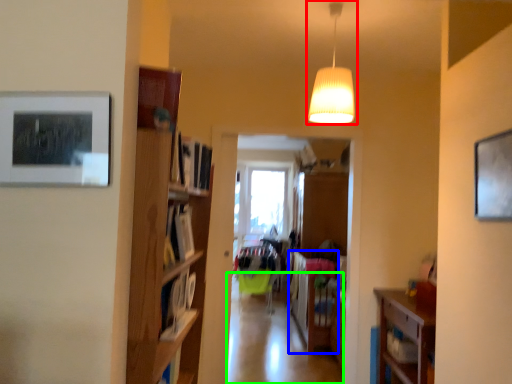
Question: Based on their relative distances, which object is farther from lamp (highlighted by a red box)? Choose from table (highlighted by a blue box) and aisle (highlighted by a green box).

Choices:
 (A) table
 (B) aisle

Answer: (B)